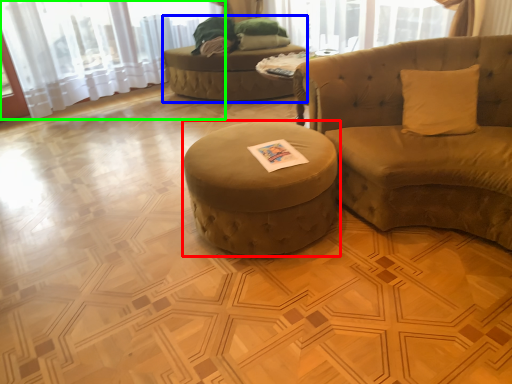
Question: Which object is positioned farthest from table (highlighted by a red box)? Select from bean bag chair (highlighted by a blue box) and curtain (highlighted by a green box).

Choices:
 (A) bean bag chair
 (B) curtain

Answer: (B)